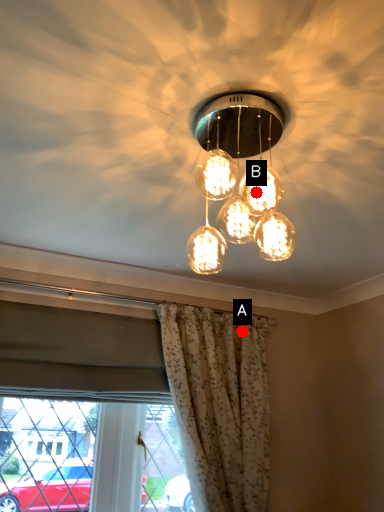
Question: Two points are circled on the image, labeled by A and B beside each circle. Which point is farther to the camera?

Choices:
 (A) A is further
 (B) B is further

Answer: (A)